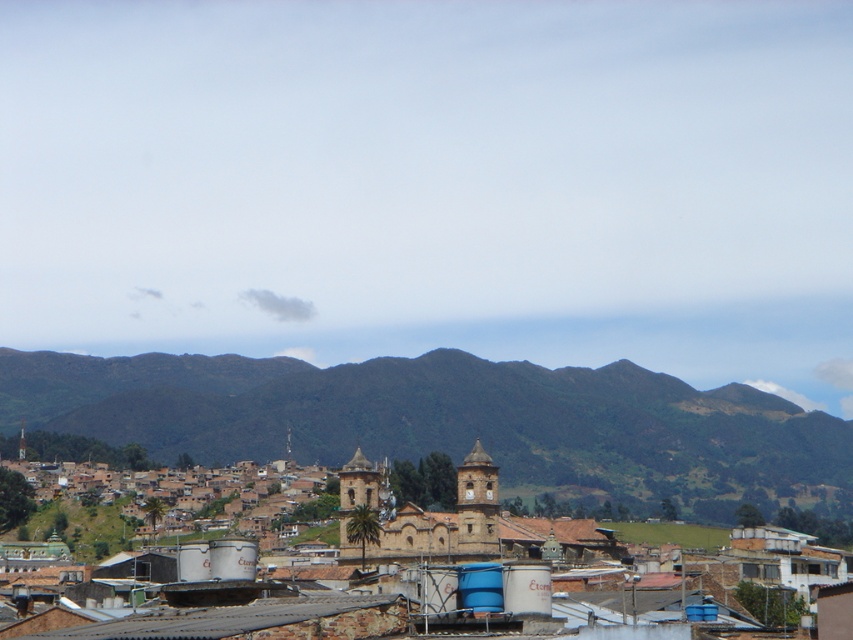
Question: Does green grassy mountain at center have a larger size compared to brown stone church at center?

Choices:
 (A) no
 (B) yes

Answer: (B)

Question: Is green grassy mountain at center below brown stone church at center?

Choices:
 (A) yes
 (B) no

Answer: (A)

Question: Does green grassy mountain at center have a greater width compared to brown stone church at center?

Choices:
 (A) no
 (B) yes

Answer: (B)

Question: Which object is closer to the camera taking this photo?

Choices:
 (A) brown stone church at center
 (B) green grassy mountain at center

Answer: (A)

Question: Which point is closer to the camera taking this photo?

Choices:
 (A) (438, 513)
 (B) (685, 384)

Answer: (A)

Question: Among these objects, which one is farthest from the camera?

Choices:
 (A) green grassy mountain at center
 (B) brown stone church at center

Answer: (A)